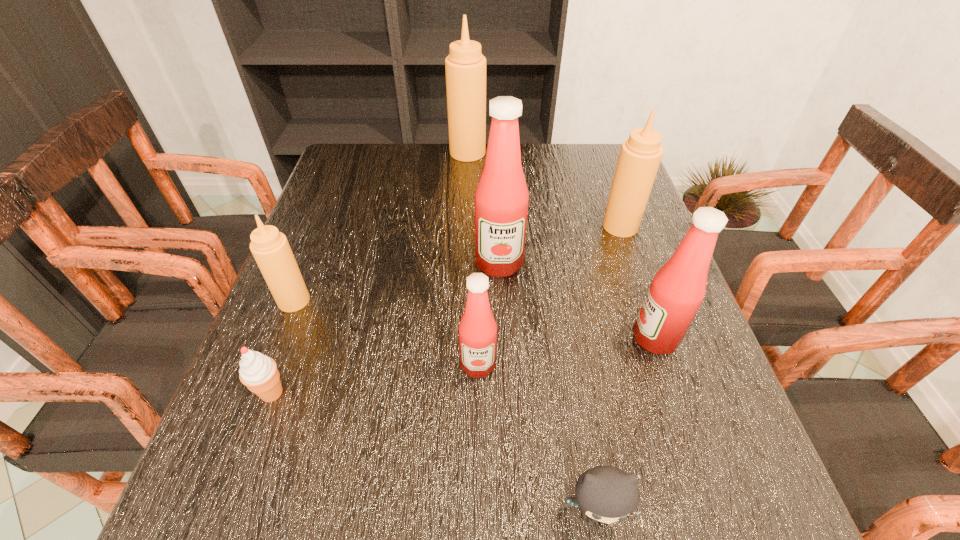
Where is `vacant space at the far left corner`? The height and width of the screenshot is (540, 960). vacant space at the far left corner is located at coordinates (333, 170).

The image size is (960, 540). In order to click on vacant point at the far right corner in this screenshot , I will do `click(573, 145)`.

Find the location of `empty space between the second farthest object and the farthest red condiment`. empty space between the second farthest object and the farthest red condiment is located at coordinates (560, 245).

Where is `unoccupied area between the leftmost condiment and the biggest red condiment`? Image resolution: width=960 pixels, height=540 pixels. unoccupied area between the leftmost condiment and the biggest red condiment is located at coordinates (396, 282).

Where is `vacant point located between the leftmost tan condiment and the farthest tan condiment`? The width and height of the screenshot is (960, 540). vacant point located between the leftmost tan condiment and the farthest tan condiment is located at coordinates (381, 226).

Identify the location of free area in between the smallest red condiment and the second biggest red condiment. The width and height of the screenshot is (960, 540). (566, 352).

Identify the location of free space that is in between the biggest red condiment and the second smallest tan condiment. The width and height of the screenshot is (960, 540). (560, 245).

The width and height of the screenshot is (960, 540). In order to click on vacant area that lies between the smallest red condiment and the icecream in this screenshot , I will do `click(375, 379)`.

What are the coordinates of `vacant area that lies between the fourth nearest condiment and the third object from right to left` in the screenshot? It's located at (547, 388).

You are a GUI agent. You are given a task and a screenshot of the screen. Output one action in this format:
    pyautogui.click(x=<x>, y=<y>)
    Task: Click on the free area in between the farthest condiment and the second biggest red condiment
    The image size is (960, 540).
    Given the screenshot: What is the action you would take?
    coord(562,245)